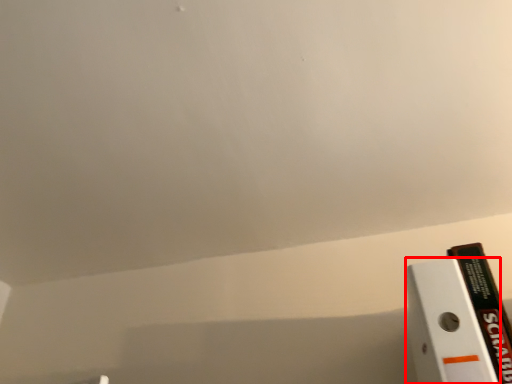
Question: Observing the image, what is the correct spatial positioning of paperback book (annotated by the red box) in reference to book?

Choices:
 (A) left
 (B) right

Answer: (A)